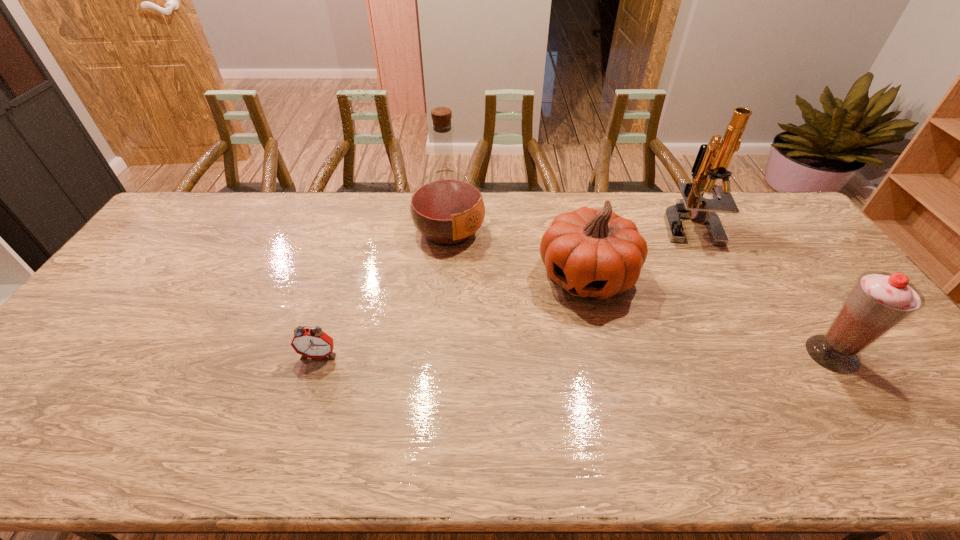
Identify the location of vacant space on the desktop that is between the leftmost object and the third tallest object and is positioned on the front label of the second object from left to right. tap(648, 354).

In order to click on free space on the desktop that is between the shortest object and the smoothie and is positioned at the eyepiece of the fourth object from left to right in this screenshot , I will do `click(632, 354)`.

Where is `free spot on the desktop that is between the leftmost object and the smoothie and is positioned on the face of the pumpkin`? This screenshot has width=960, height=540. free spot on the desktop that is between the leftmost object and the smoothie and is positioned on the face of the pumpkin is located at coordinates coord(546,354).